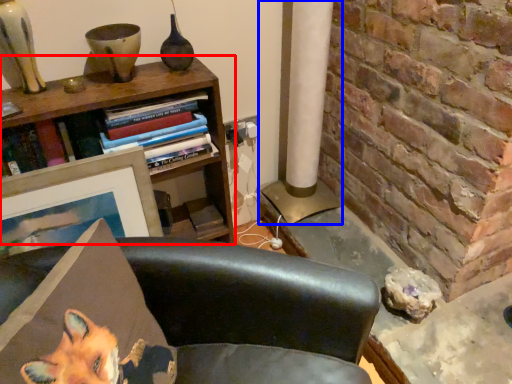
Question: Which object appears farthest to the camera in this image, bookcase (highlighted by a red box) or pillar (highlighted by a blue box)?

Choices:
 (A) bookcase
 (B) pillar

Answer: (B)